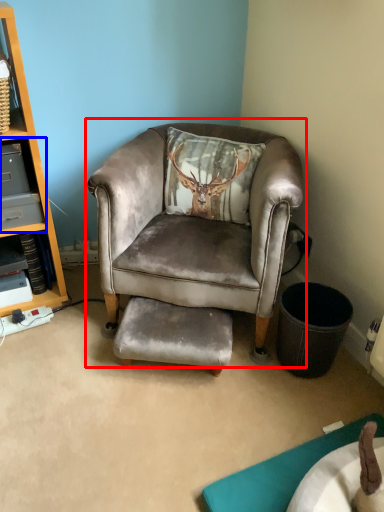
Question: Which object is further to the camera taking this photo, chair (highlighted by a red box) or shelf (highlighted by a blue box)?

Choices:
 (A) chair
 (B) shelf

Answer: (B)